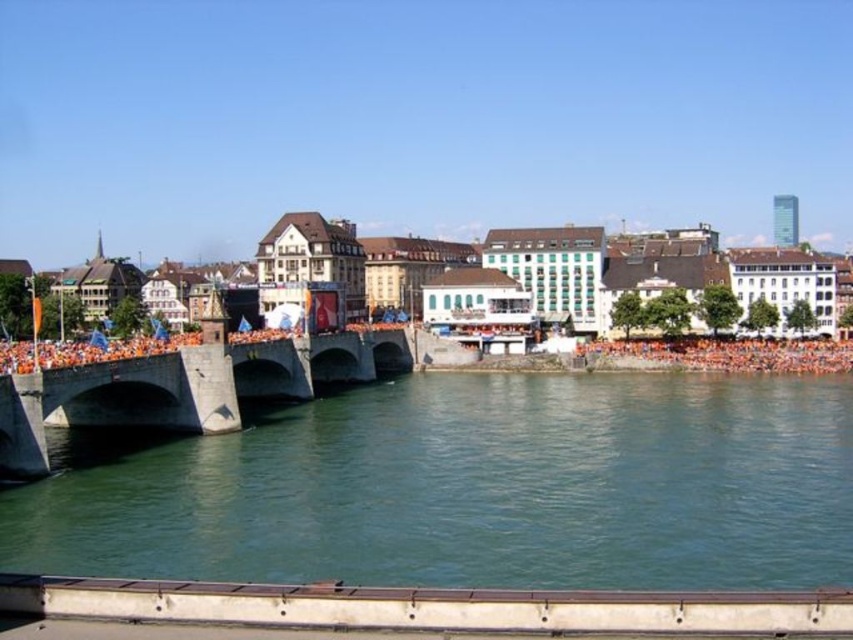
Question: Which object appears farthest from the camera in this image?

Choices:
 (A) orange cloth crowd at lower right
 (B) concrete bridge at center

Answer: (A)

Question: Can you confirm if green stone river at center is wider than concrete bridge at center?

Choices:
 (A) yes
 (B) no

Answer: (A)

Question: Considering the real-world distances, which object is closest to the green stone river at center?

Choices:
 (A) concrete bridge at center
 (B) orange cloth crowd at lower right

Answer: (A)

Question: Is green stone river at center positioned at the back of concrete bridge at center?

Choices:
 (A) yes
 (B) no

Answer: (B)

Question: Where is green stone river at center located in relation to orange cloth crowd at lower right in the image?

Choices:
 (A) left
 (B) right

Answer: (A)

Question: Which of the following is the closest to the observer?

Choices:
 (A) concrete bridge at center
 (B) green stone river at center
 (C) orange cloth crowd at lower right

Answer: (B)